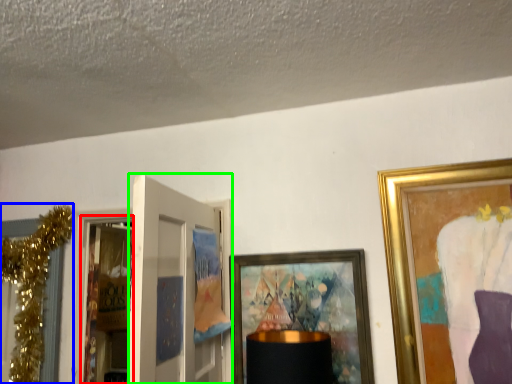
Question: Which object is positioned closest to screen door (highlighted by a red box)? Select from christmas decoration (highlighted by a blue box) and door (highlighted by a green box).

Choices:
 (A) christmas decoration
 (B) door

Answer: (A)